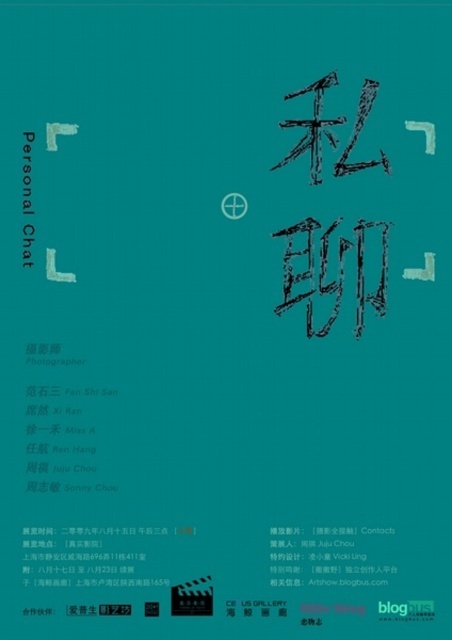
What do you see at coordinates (324, 556) in the screenshot?
I see `black paper at center` at bounding box center [324, 556].

Does black paper at center appear under white paper at center?

Correct, black paper at center is located below white paper at center.

Which is in front, point (282, 576) or point (23, 211)?

Positioned in front is point (23, 211).

Where is `black paper at center`? The height and width of the screenshot is (640, 452). black paper at center is located at coordinates (324, 556).